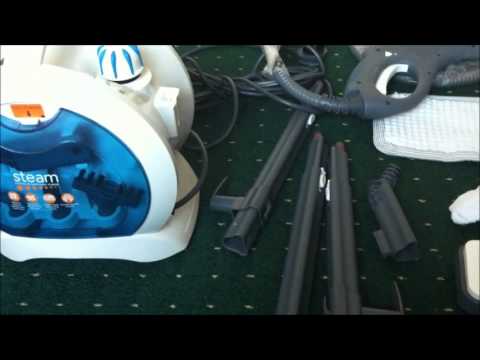
Locate an element on the screen. The image size is (480, 360). steam cleaner gun trigger is located at coordinates (383, 79).